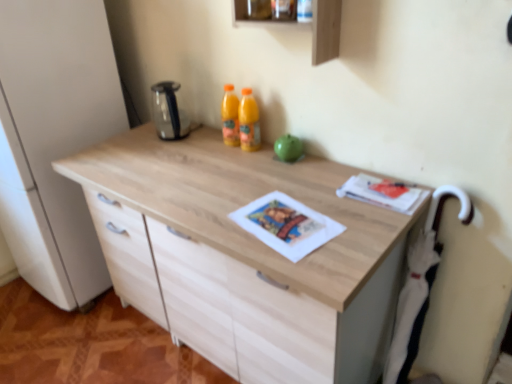
Question: Is stainless steel kettle at upper center facing away from wooden shelf at upper center, acting as the 1th shelf starting from the bottom?

Choices:
 (A) yes
 (B) no

Answer: (B)

Question: Is stainless steel kettle at upper center not inside wooden shelf at upper center, the second shelf when ordered from top to bottom?

Choices:
 (A) no
 (B) yes

Answer: (B)

Question: Is stainless steel kettle at upper center directly adjacent to wooden shelf at upper center, acting as the 1th shelf starting from the bottom?

Choices:
 (A) no
 (B) yes

Answer: (A)

Question: Is wooden shelf at upper center, acting as the 1th shelf starting from the bottom, located within stainless steel kettle at upper center?

Choices:
 (A) yes
 (B) no

Answer: (B)

Question: Does stainless steel kettle at upper center have a lesser width compared to wooden shelf at upper center, the second shelf when ordered from top to bottom?

Choices:
 (A) no
 (B) yes

Answer: (A)

Question: From a real-world perspective, is wooden shelf at upper center, acting as the 1th shelf starting from the bottom, positioned above or below wooden frame at upper center, marked as the first shelf in a top-to-bottom arrangement?

Choices:
 (A) below
 (B) above

Answer: (A)

Question: In terms of width, does wooden shelf at upper center, acting as the 1th shelf starting from the bottom, look wider or thinner when compared to wooden frame at upper center, positioned as the 2th shelf in bottom-to-top order?

Choices:
 (A) thin
 (B) wide

Answer: (A)

Question: Is wooden shelf at upper center, acting as the 1th shelf starting from the bottom, in front of or behind wooden frame at upper center, marked as the first shelf in a top-to-bottom arrangement, in the image?

Choices:
 (A) front
 (B) behind

Answer: (A)

Question: Considering the positions of wooden shelf at upper center, the second shelf when ordered from top to bottom, and wooden frame at upper center, positioned as the 2th shelf in bottom-to-top order, in the image, is wooden shelf at upper center, the second shelf when ordered from top to bottom, taller or shorter than wooden frame at upper center, positioned as the 2th shelf in bottom-to-top order,?

Choices:
 (A) short
 (B) tall

Answer: (B)

Question: In terms of height, does matte paper magazine at upper right look taller or shorter compared to stainless steel kettle at upper center?

Choices:
 (A) short
 (B) tall

Answer: (A)

Question: From a real-world perspective, is matte paper magazine at upper right positioned above or below stainless steel kettle at upper center?

Choices:
 (A) above
 (B) below

Answer: (B)

Question: Looking at the image, does matte paper magazine at upper right seem bigger or smaller compared to stainless steel kettle at upper center?

Choices:
 (A) small
 (B) big

Answer: (A)

Question: In terms of width, does matte paper magazine at upper right look wider or thinner when compared to stainless steel kettle at upper center?

Choices:
 (A) thin
 (B) wide

Answer: (B)

Question: From the image's perspective, is matte paper magazine at upper right positioned above or below wooden shelf at upper center, the second shelf when ordered from top to bottom?

Choices:
 (A) below
 (B) above

Answer: (A)

Question: From a real-world perspective, is matte paper magazine at upper right above or below wooden shelf at upper center, acting as the 1th shelf starting from the bottom?

Choices:
 (A) above
 (B) below

Answer: (B)